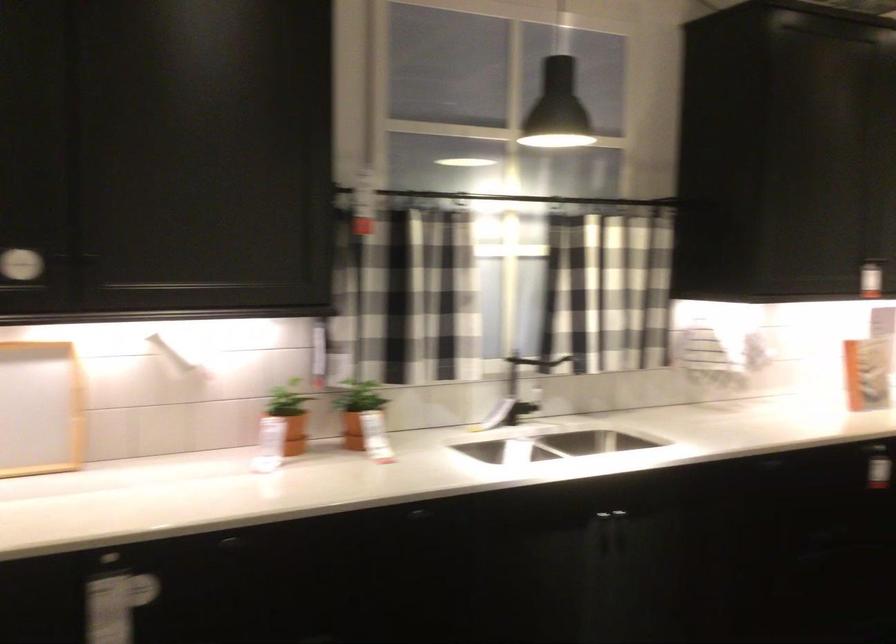
This screenshot has height=644, width=896. What do you see at coordinates (520, 370) in the screenshot?
I see `the black faucet handle` at bounding box center [520, 370].